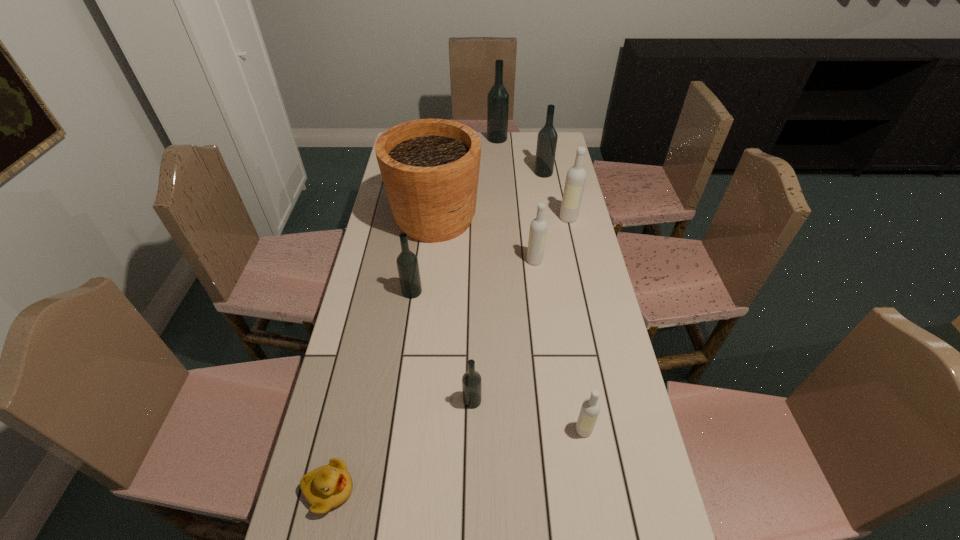
The height and width of the screenshot is (540, 960). Identify the location of the farthest black vodka. (498, 97).

Where is `the farthest object`? the farthest object is located at coordinates (498, 97).

Identify the location of flowerpot. The width and height of the screenshot is (960, 540). (430, 168).

Image resolution: width=960 pixels, height=540 pixels. Identify the location of the second farthest object. (547, 138).

You are a GUI agent. You are given a task and a screenshot of the screen. Output one action in this format:
    pyautogui.click(x=<x>, y=<y>)
    Task: Click on the third nearest black vodka
    The width and height of the screenshot is (960, 540).
    Given the screenshot: What is the action you would take?
    pyautogui.click(x=547, y=138)

I want to click on the biggest white vodka, so coord(575,181).

The image size is (960, 540). I want to click on the farthest white vodka, so click(x=575, y=181).

Identify the location of the sixth object from left to right. (538, 228).

Locate an element on the screen. The image size is (960, 540). the fourth nearest vodka is located at coordinates (538, 228).

Locate an element on the screen. the second smallest black vodka is located at coordinates (407, 262).